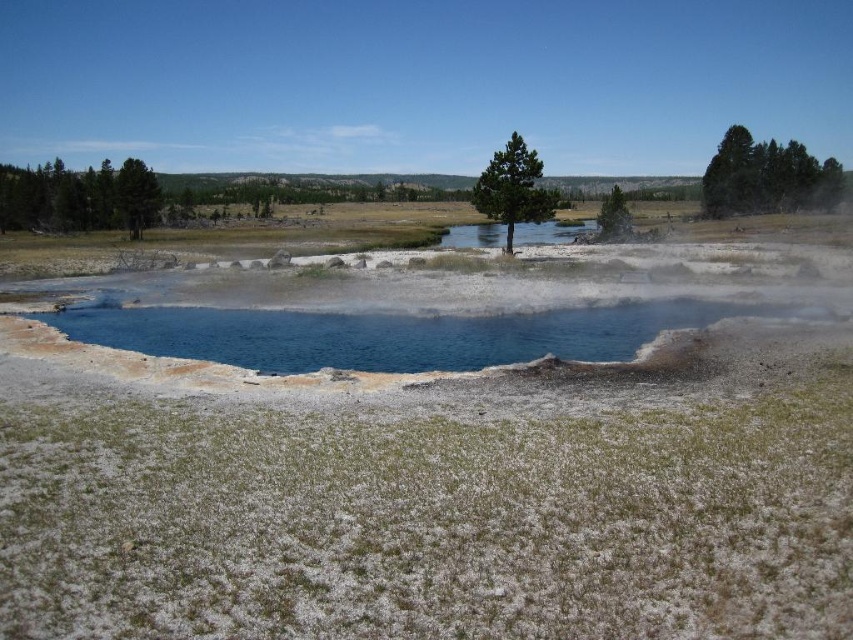
You are standing in the natural landscape and see the green matte tree at center and the green matte tree at left. Which tree is closer to your left side?

The green matte tree at left is closer to your left side because it is positioned to the left of the green matte tree at center.

You are standing at the center of the image and want to locate the green textured tree at left. In which direction should you look to find it?

The green textured tree at left is located at the left side of the image, so you should look to your left to find it.

You are a hiker carrying a 1.5 meter wide backpack. You want to cross from the grassy area to the blue water at center. There is a green matte tree at center in between. Can you pass through the gap between them without your backpack touching either?

The distance between blue water at center and green matte tree at center is 17.18 meters. Since your backpack is only 1.5 meters wide, there is ample space to pass through the gap safely without touching either object.